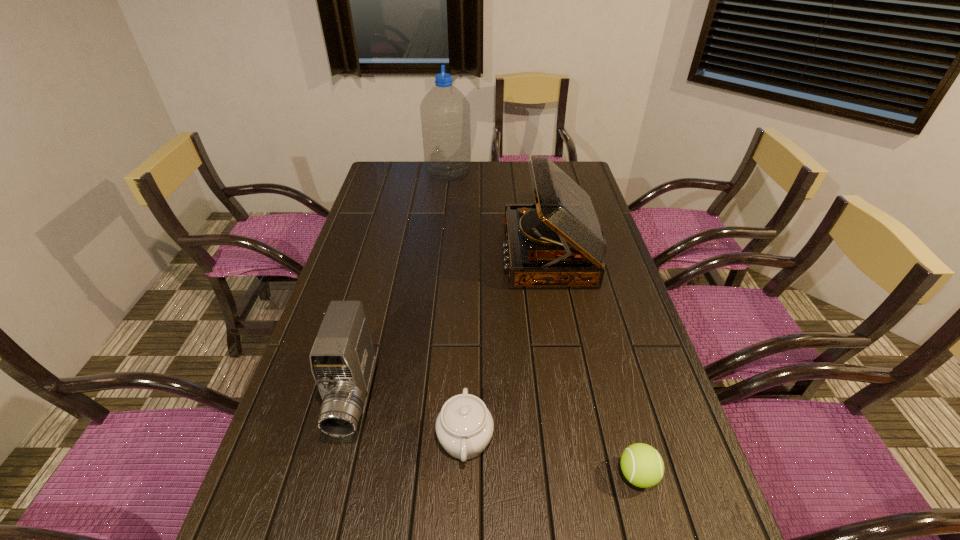
Locate an element on the screen. This screenshot has width=960, height=540. empty space between the shortest object and the farthest object is located at coordinates (542, 324).

Find the location of a particular element. The image size is (960, 540). vacant space that is in between the chinaware and the third tallest object is located at coordinates (410, 418).

Identify which object is the second nearest to the leftmost object. Please provide its 2D coordinates. Your answer should be formatted as a tuple, i.e. [(x, y)], where the tuple contains the x and y coordinates of a point satisfying the conditions above.

[(558, 242)]

The width and height of the screenshot is (960, 540). Find the location of `object identified as the second closest to the tallest object`. object identified as the second closest to the tallest object is located at coordinates (342, 358).

Image resolution: width=960 pixels, height=540 pixels. I want to click on vacant region that satisfies the following two spatial constraints: 1. at the front of the third tallest object, highlighting the lens; 2. on the right side of the chinaware, so click(x=344, y=439).

This screenshot has width=960, height=540. In order to click on vacant region that satisfies the following two spatial constraints: 1. on the front-facing side of the fourth nearest object; 2. on the left side of the shortest object in this screenshot , I will do `click(590, 475)`.

Identify the location of vacant region that satisfies the following two spatial constraints: 1. at the front of the leftmost object, highlighting the lens; 2. on the right side of the tennis ball. (335, 475).

You are a GUI agent. You are given a task and a screenshot of the screen. Output one action in this format:
    pyautogui.click(x=<x>, y=<y>)
    Task: Click on the vacant space that satisfies the following two spatial constraints: 1. at the front of the third shortest object, highlighting the lens; 2. on the right side of the second shortest object
    The width and height of the screenshot is (960, 540).
    Given the screenshot: What is the action you would take?
    pyautogui.click(x=344, y=439)

The width and height of the screenshot is (960, 540). In order to click on free space that satisfies the following two spatial constraints: 1. on the front-facing side of the record player; 2. at the front of the camcorder, highlighting the lens in this screenshot , I will do `click(576, 398)`.